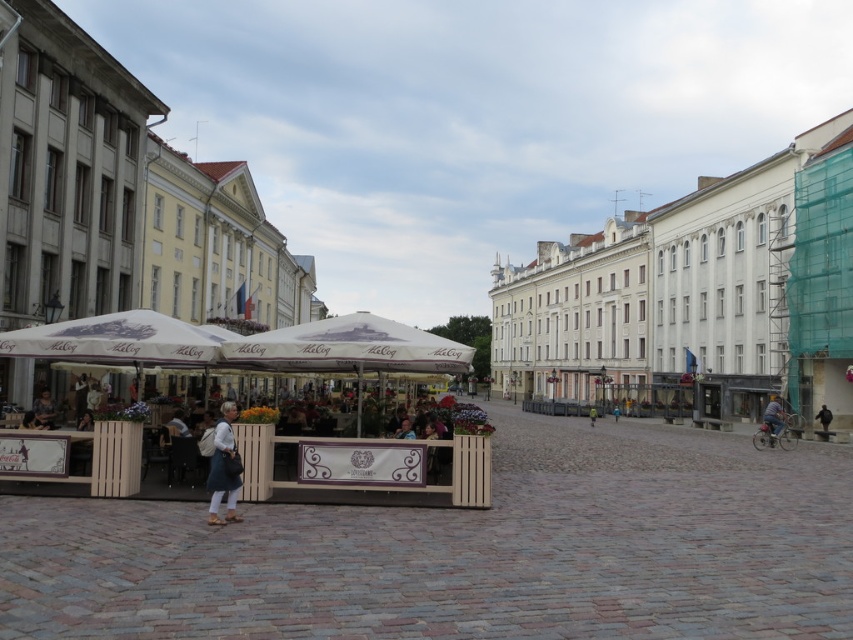
Question: Can you confirm if white wood market at center is positioned above matte black jacket at lower left?

Choices:
 (A) yes
 (B) no

Answer: (A)

Question: Which of the following is the farthest from the observer?

Choices:
 (A) white fabric canopy at center
 (B) matte black jacket at lower left
 (C) black leather jacket at center
 (D) green fabric jacket at center

Answer: (D)

Question: Which point is closer to the camera taking this photo?

Choices:
 (A) [299, 330]
 (B) [61, 324]
 (C) [213, 477]

Answer: (C)

Question: Is white fabric canopy at center positioned at the back of green fabric jacket at center?

Choices:
 (A) yes
 (B) no

Answer: (B)

Question: Can you confirm if light blue denim jacket at lower left is positioned above green fabric jacket at center?

Choices:
 (A) no
 (B) yes

Answer: (B)

Question: Estimate the real-world distances between objects in this image. Which object is farther from the blue denim jeans at lower right?

Choices:
 (A) white fabric canopy at center
 (B) black leather jacket at center
 (C) white wood market at center
 (D) matte black jacket at lower left

Answer: (D)